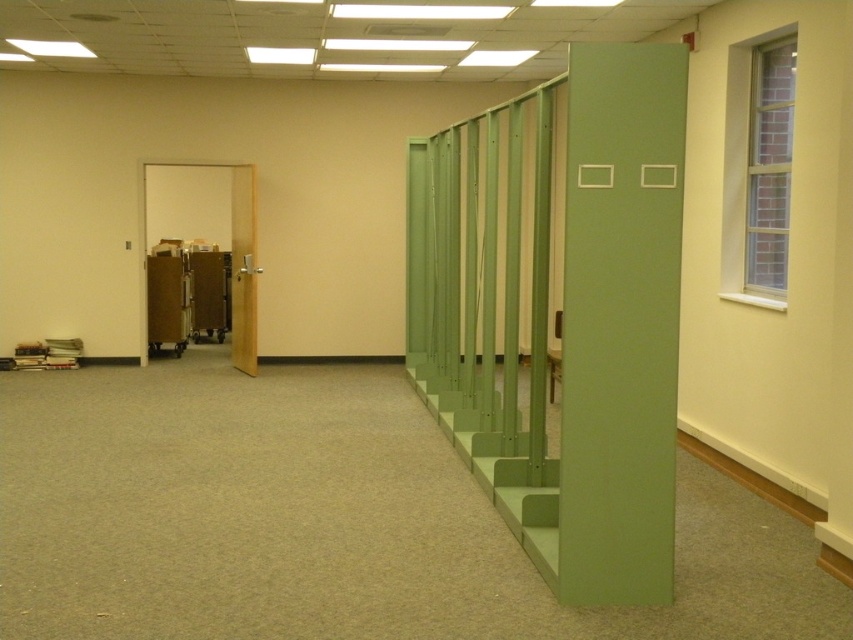
Is point (598, 563) positioned before point (239, 195)?

Yes.

Who is more forward, [672,506] or [242,353]?

Point [672,506]

Image resolution: width=853 pixels, height=640 pixels. Find the location of `green matte locker at right`. green matte locker at right is located at coordinates (619, 323).